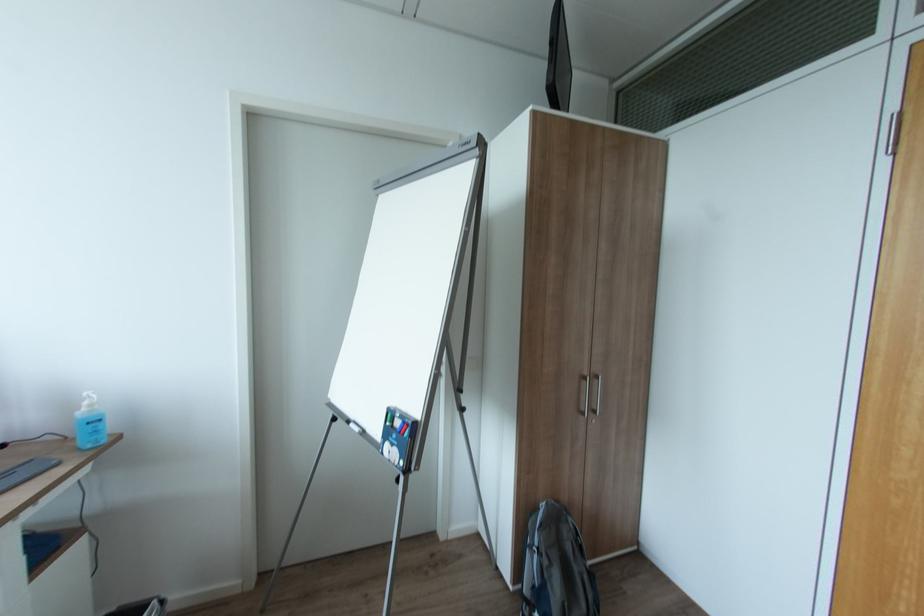
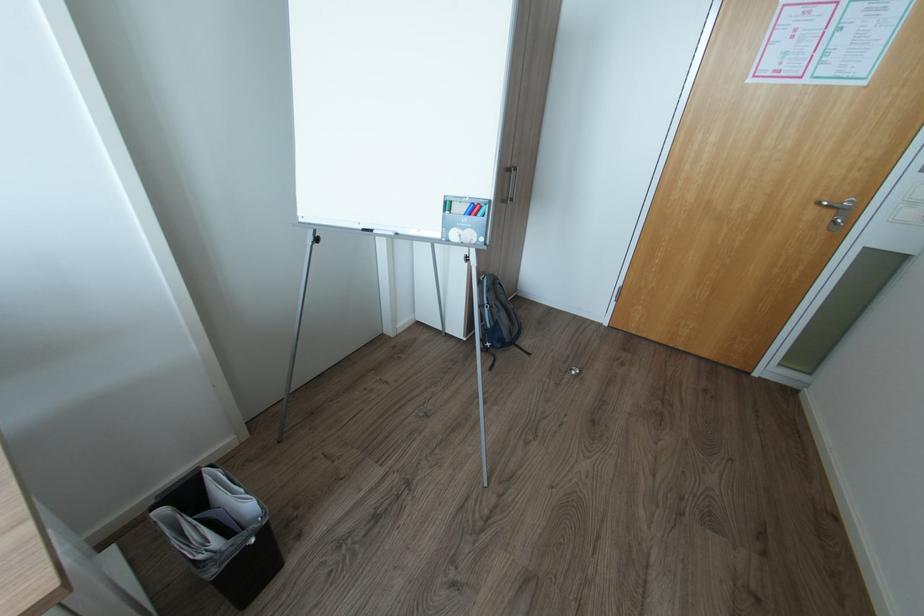
Find the pixel in the second image that matches point (356, 424) in the first image.

(380, 231)